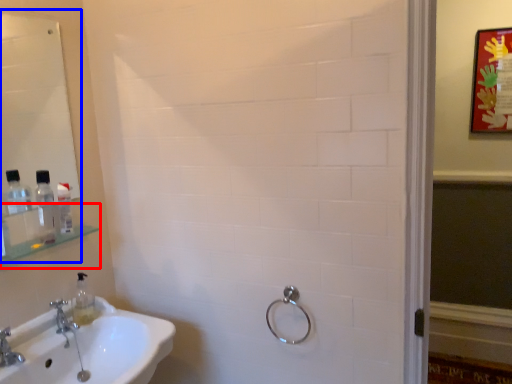
Question: Among these objects, which one is nearest to the camera, shelf (highlighted by a red box) or mirror (highlighted by a blue box)?

Choices:
 (A) shelf
 (B) mirror

Answer: (B)